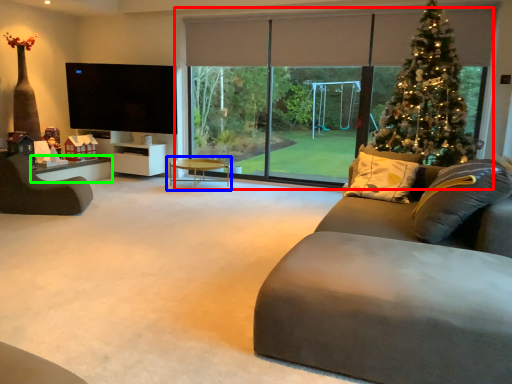
Question: Based on their relative distances, which object is nearer to window (highlighted by a red box)? Choose from coffee table (highlighted by a blue box) and table (highlighted by a green box).

Choices:
 (A) coffee table
 (B) table

Answer: (A)